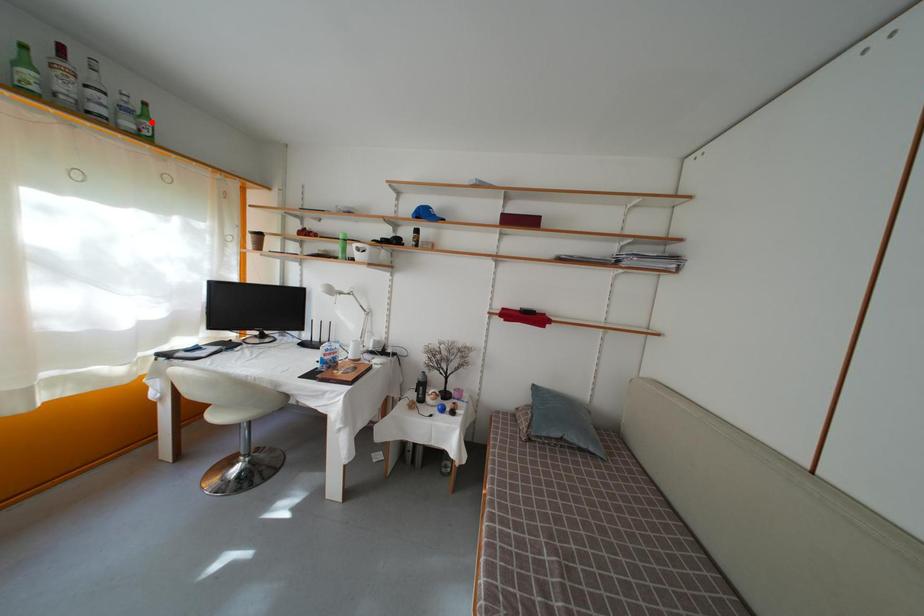
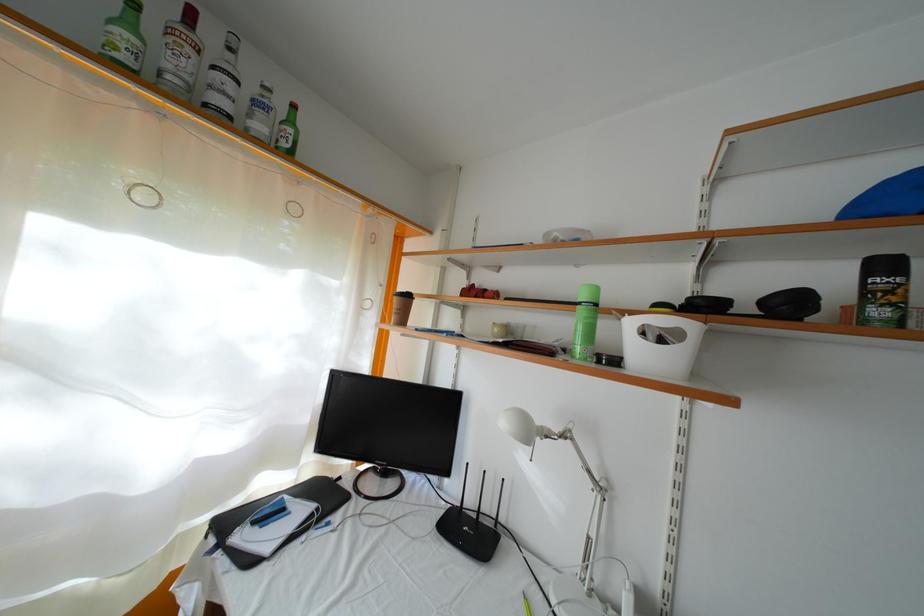
The point at the highlighted location is marked in the first image. Where is the corresponding point in the second image?

(297, 128)